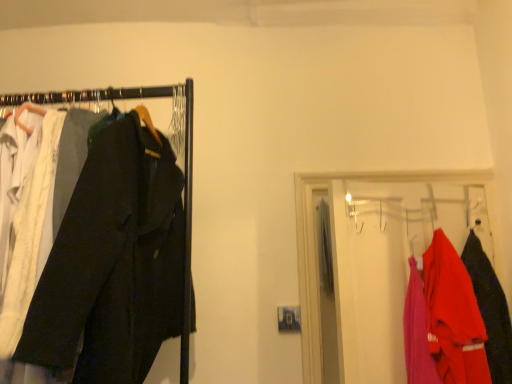
Question: In the image, is dark gray cotton trousers at left positioned in front of or behind matte red jacket at right, which appears as the 2th clothing when viewed from the left?

Choices:
 (A) front
 (B) behind

Answer: (A)

Question: From the image's perspective, is dark gray cotton trousers at left positioned above or below matte red jacket at right, the 1th clothing when ordered from right to left?

Choices:
 (A) below
 (B) above

Answer: (B)

Question: Which is farther from the matte red jacket at right, the 1th clothing when ordered from right to left?

Choices:
 (A) dark gray cotton trousers at left
 (B) matte red jacket at right, placed as the 2th clothing when sorted from right to left
 (C) matte red jacket at right

Answer: (A)

Question: Which is farther from the matte red jacket at right, placed as the 2th clothing when sorted from right to left?

Choices:
 (A) matte red jacket at right, the 1th clothing when ordered from right to left
 (B) dark gray cotton trousers at left
 (C) matte red jacket at right

Answer: (B)